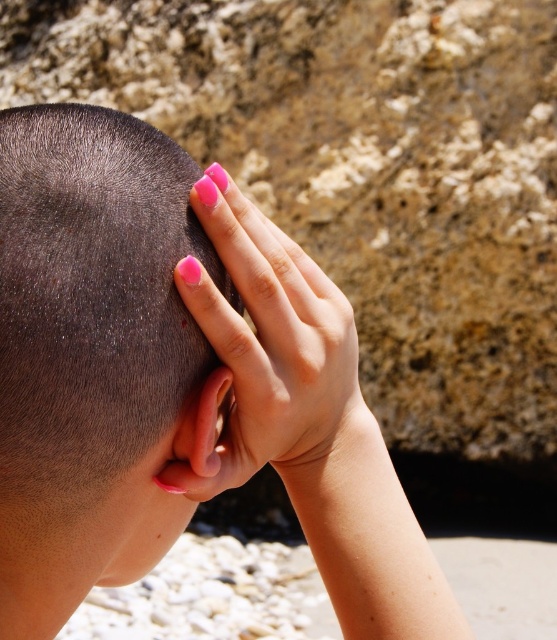
Which is above, matte black hair at center or pink polished nails at upper center?

pink polished nails at upper center

Is matte black hair at center smaller than pink polished nails at upper center?

Incorrect, matte black hair at center is not smaller in size than pink polished nails at upper center.

Where is `matte black hair at center`? Image resolution: width=557 pixels, height=640 pixels. matte black hair at center is located at coordinates (95, 356).